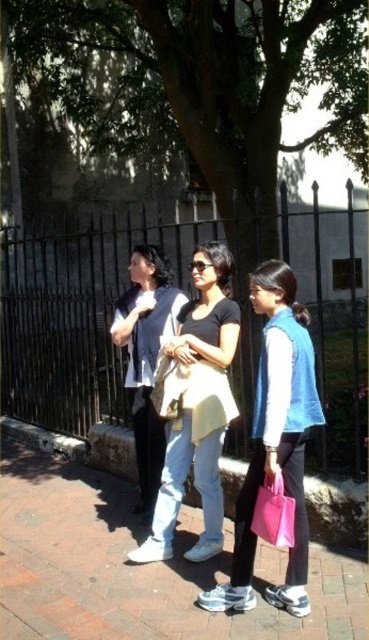
Between matte yellow shirt at center and pink fabric bag at lower center, which one is positioned lower?

pink fabric bag at lower center is below.

Is matte yellow shirt at center to the right of pink fabric bag at lower center from the viewer's perspective?

Correct, you'll find matte yellow shirt at center to the right of pink fabric bag at lower center.

Is point (287, 573) positioned before point (294, 525)?

No.

You are a GUI agent. You are given a task and a screenshot of the screen. Output one action in this format:
    pyautogui.click(x=<x>, y=<y>)
    Task: Click on the matte yellow shirt at center
    This screenshot has height=640, width=369.
    Given the screenshot: What is the action you would take?
    pyautogui.click(x=274, y=440)

Does brick pavement at center come behind matte white shirt at center?

No.

Is brick pavement at center wider than matte white shirt at center?

Yes.

Looking at this image, measure the distance between point (73, 484) and camera.

Point (73, 484) is 16.96 feet from camera.

Locate an element on the screen. This screenshot has width=369, height=640. brick pavement at center is located at coordinates (132, 568).

Which is in front, point (216, 99) or point (291, 481)?

Positioned in front is point (291, 481).

What do you see at coordinates (205, 88) in the screenshot? Image resolution: width=369 pixels, height=640 pixels. I see `green leafy tree at center` at bounding box center [205, 88].

Identify the location of green leafy tree at center. The height and width of the screenshot is (640, 369). (205, 88).